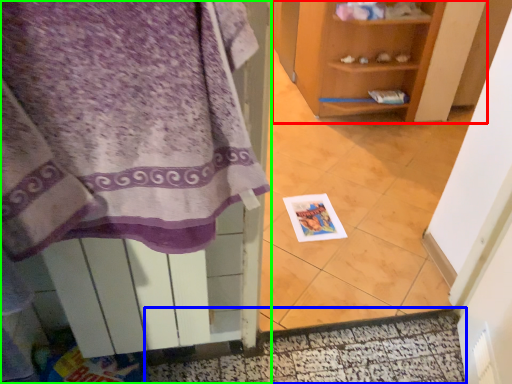
Question: Considering the real-world distances, which object is farthest from shelf (highlighted by a red box)? door (highlighted by a blue box) or cabinetry (highlighted by a green box)?

Choices:
 (A) door
 (B) cabinetry

Answer: (B)